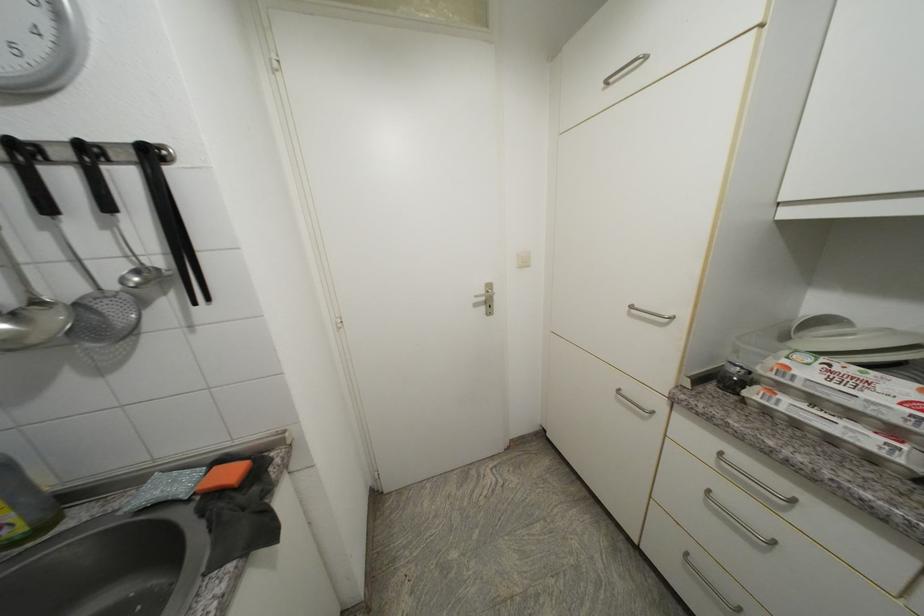
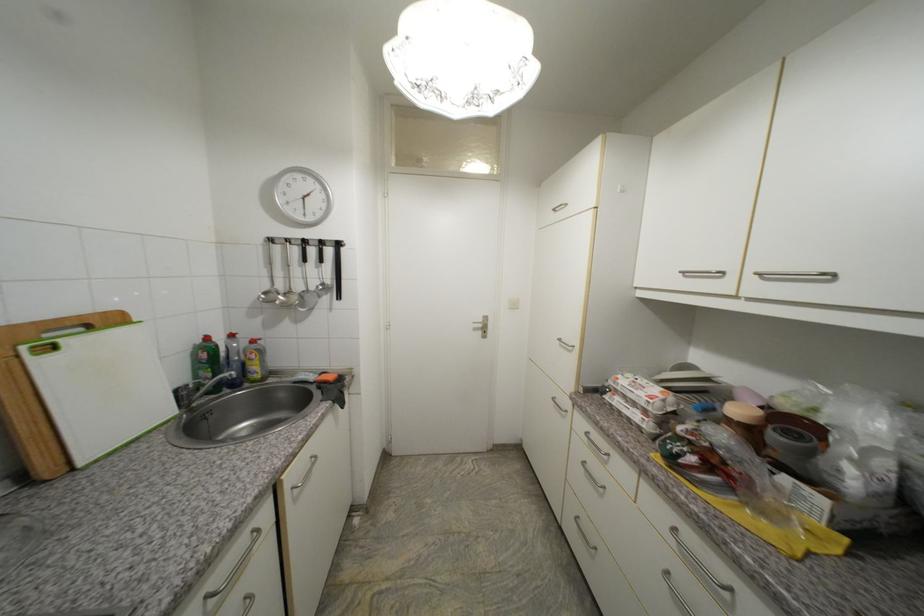
The point at [70,290] is marked in the first image. Where is the corresponding point in the second image?

(305, 289)